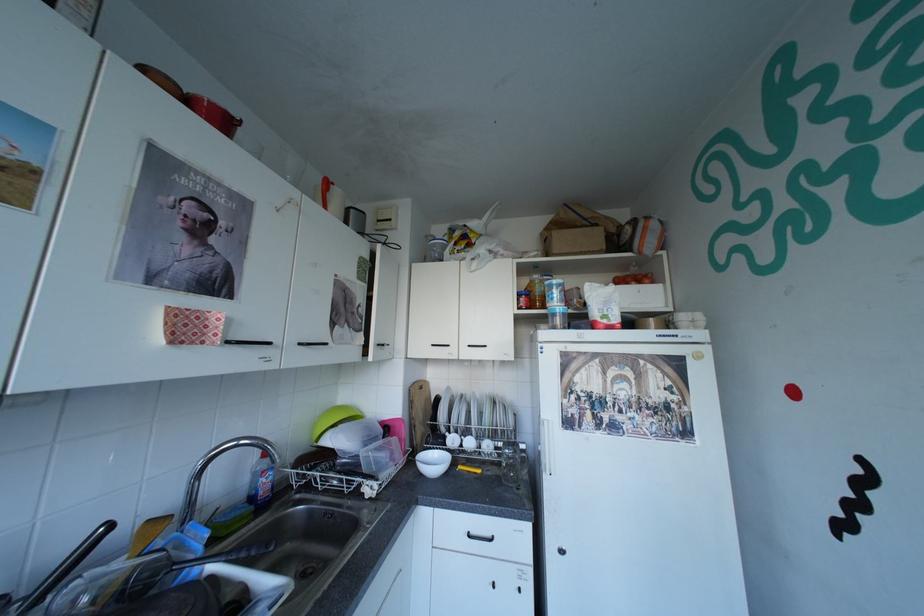
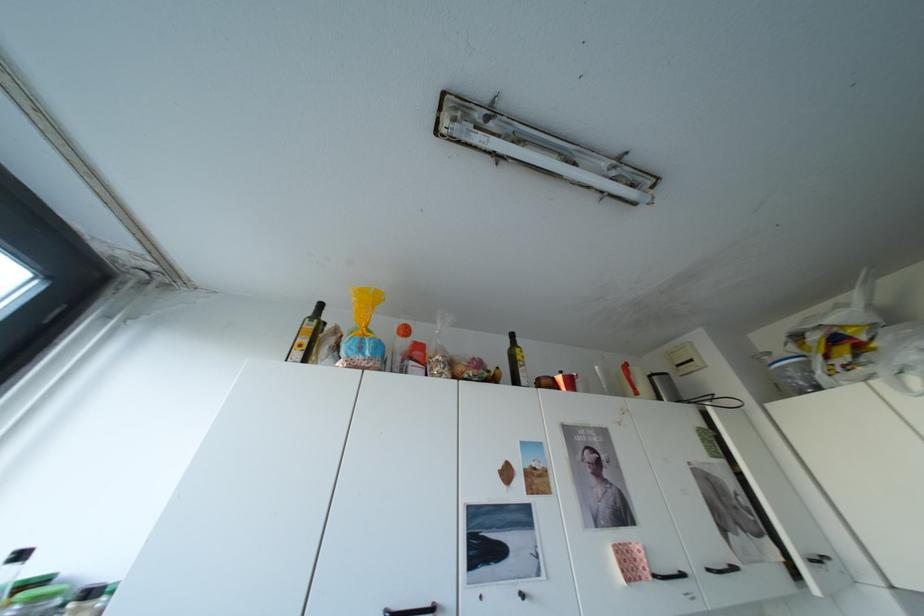
The point at (446,261) is marked in the first image. Where is the corresponding point in the second image?

(813, 391)